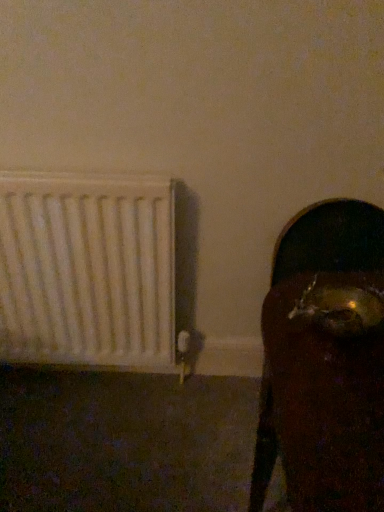
What do you see at coordinates (88, 273) in the screenshot?
I see `white matte radiator at left` at bounding box center [88, 273].

Find the location of a particular element. The image size is (384, 512). white matte radiator at left is located at coordinates (88, 273).

The image size is (384, 512). What do you see at coordinates (325, 362) in the screenshot?
I see `gold metallic skull at right` at bounding box center [325, 362].

Locate an element on the screen. The image size is (384, 512). gold metallic skull at right is located at coordinates (325, 362).

The width and height of the screenshot is (384, 512). Identify the location of white matte radiator at left. (88, 273).

Is white matte radiator at left to the left of gold metallic skull at right from the viewer's perspective?

Yes.

Considering their positions, is white matte radiator at left located in front of or behind gold metallic skull at right?

white matte radiator at left is positioned farther from the viewer than gold metallic skull at right.

Is point (48, 268) more distant than point (377, 414)?

Yes, point (48, 268) is behind point (377, 414).

From the image's perspective, does white matte radiator at left appear lower than gold metallic skull at right?

No, from the image's perspective, white matte radiator at left is not below gold metallic skull at right.

From a real-world perspective, is white matte radiator at left positioned over gold metallic skull at right based on gravity?

Yes, from a real-world perspective, white matte radiator at left is on top of gold metallic skull at right.

Between white matte radiator at left and gold metallic skull at right, which one has smaller width?

With smaller width is white matte radiator at left.

Considering the sizes of objects white matte radiator at left and gold metallic skull at right in the image provided, who is shorter, white matte radiator at left or gold metallic skull at right?

white matte radiator at left is shorter.

Does white matte radiator at left have a larger size compared to gold metallic skull at right?

No.

Would you say white matte radiator at left is outside gold metallic skull at right?

white matte radiator at left lies outside gold metallic skull at right's area.

Does white matte radiator at left touch gold metallic skull at right?

No, white matte radiator at left is not beside gold metallic skull at right.

Is white matte radiator at left positioned with its back to gold metallic skull at right?

white matte radiator at left does not have its back to gold metallic skull at right.

Locate an element on the screen. This screenshot has width=384, height=512. radiator above the gold metallic skull at right (from the image's perspective) is located at coordinates [x=88, y=273].

Looking at this image, which is more to the left, gold metallic skull at right or white matte radiator at left?

white matte radiator at left is more to the left.

In the image, is gold metallic skull at right positioned in front of or behind white matte radiator at left?

Clearly, gold metallic skull at right is in front of white matte radiator at left.

Is point (263, 320) closer or farther from the camera than point (79, 208)?

Point (263, 320) is positioned closer to the camera compared to point (79, 208).

Based on the photo, from the image's perspective, does gold metallic skull at right appear lower than white matte radiator at left?

Correct, gold metallic skull at right appears lower than white matte radiator at left in the image.

From the picture: From a real-world perspective, is gold metallic skull at right physically above white matte radiator at left?

Actually, gold metallic skull at right is physically below white matte radiator at left in the real world.

Considering the sizes of objects gold metallic skull at right and white matte radiator at left in the image provided, who is wider, gold metallic skull at right or white matte radiator at left?

gold metallic skull at right is wider.

Who is shorter, gold metallic skull at right or white matte radiator at left?

With less height is white matte radiator at left.

Considering the sizes of objects gold metallic skull at right and white matte radiator at left in the image provided, who is bigger, gold metallic skull at right or white matte radiator at left?

gold metallic skull at right is bigger.

Would you say gold metallic skull at right contains white matte radiator at left?

No.

Are gold metallic skull at right and white matte radiator at left far apart?

They are positioned close to each other.

Is gold metallic skull at right oriented towards white matte radiator at left?

No, gold metallic skull at right is not turned towards white matte radiator at left.

How many degrees apart are the facing directions of gold metallic skull at right and white matte radiator at left?

6.21e-05 degrees separate the facing orientations of gold metallic skull at right and white matte radiator at left.

How far apart are gold metallic skull at right and white matte radiator at left?

A distance of 25.83 inches exists between gold metallic skull at right and white matte radiator at left.

I want to click on radiator that appears above the gold metallic skull at right (from the image's perspective), so click(88, 273).

Where is `furniture below the white matte radiator at left (from the image's perspective)`? furniture below the white matte radiator at left (from the image's perspective) is located at coordinates (325, 362).

Locate an element on the screen. The height and width of the screenshot is (512, 384). radiator that is behind the gold metallic skull at right is located at coordinates (88, 273).